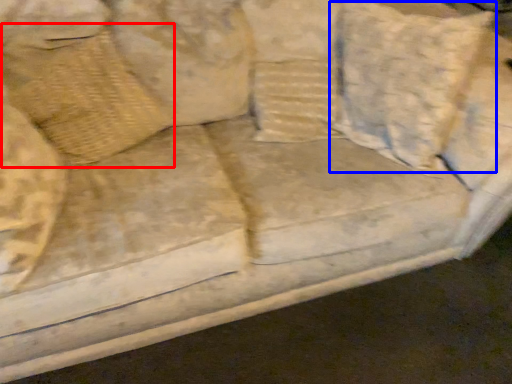
Question: Which point is further to the camera, pillow (highlighted by a red box) or pillow (highlighted by a blue box)?

Choices:
 (A) pillow
 (B) pillow

Answer: (A)